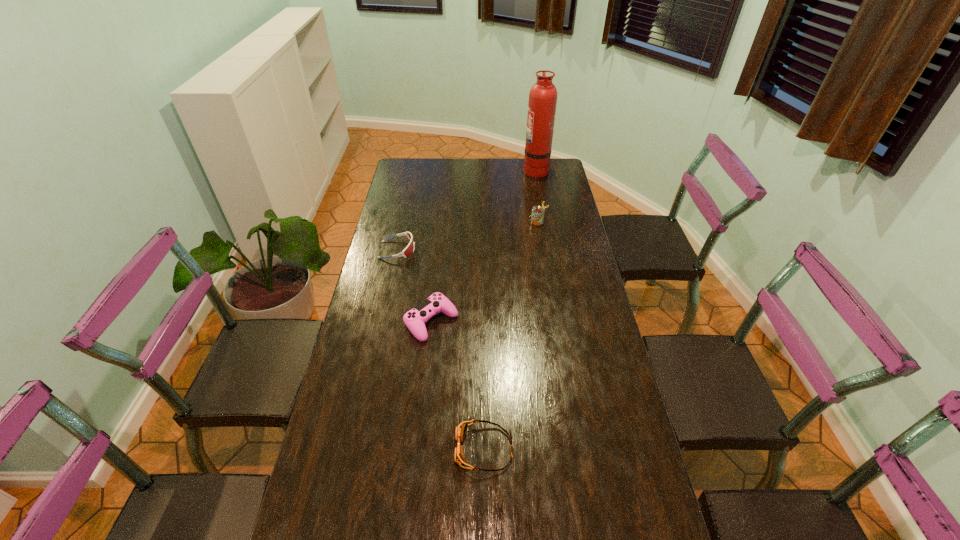
At what (x,y) coordinates should I click in order to perform the action: click on vacant area between the taller goggles and the farthest object. Please return your answer as a coordinate pair (x, y). The height and width of the screenshot is (540, 960). Looking at the image, I should click on pyautogui.click(x=467, y=210).

Find the location of a particular element. The image size is (960, 540). free space between the farthest object and the farther goggles is located at coordinates (467, 210).

Locate an element on the screen. The width and height of the screenshot is (960, 540). free space that is in between the farther goggles and the fourth nearest object is located at coordinates (468, 235).

Where is `free space that is in between the tallest object and the fourth shortest object`? This screenshot has width=960, height=540. free space that is in between the tallest object and the fourth shortest object is located at coordinates (537, 195).

At what (x,y) coordinates should I click in order to perform the action: click on free space between the third nearest object and the nearest object. Please return your answer as a coordinate pair (x, y). This screenshot has height=540, width=960. Looking at the image, I should click on 441,349.

The image size is (960, 540). Identify the location of free space between the nearest object and the can. (511, 335).

Where is `free space between the second object from left to right and the tallest object`? The width and height of the screenshot is (960, 540). free space between the second object from left to right and the tallest object is located at coordinates (484, 246).

You are a GUI agent. You are given a task and a screenshot of the screen. Output one action in this format:
    pyautogui.click(x=<x>, y=<y>)
    Task: Click on the unoccupied area between the shorter goggles and the farthest object
    
    Given the screenshot: What is the action you would take?
    pyautogui.click(x=510, y=308)

Locate which object ranks second in proximity to the fourth nearest object. Please provide its 2D coordinates. Your answer should be formatted as a tuple, i.e. [(x, y)], where the tuple contains the x and y coordinates of a point satisfying the conditions above.

[(409, 249)]

Identify which object is the third closest to the farthest object. Please provide its 2D coordinates. Your answer should be formatted as a tuple, i.e. [(x, y)], where the tuple contains the x and y coordinates of a point satisfying the conditions above.

[(415, 319)]